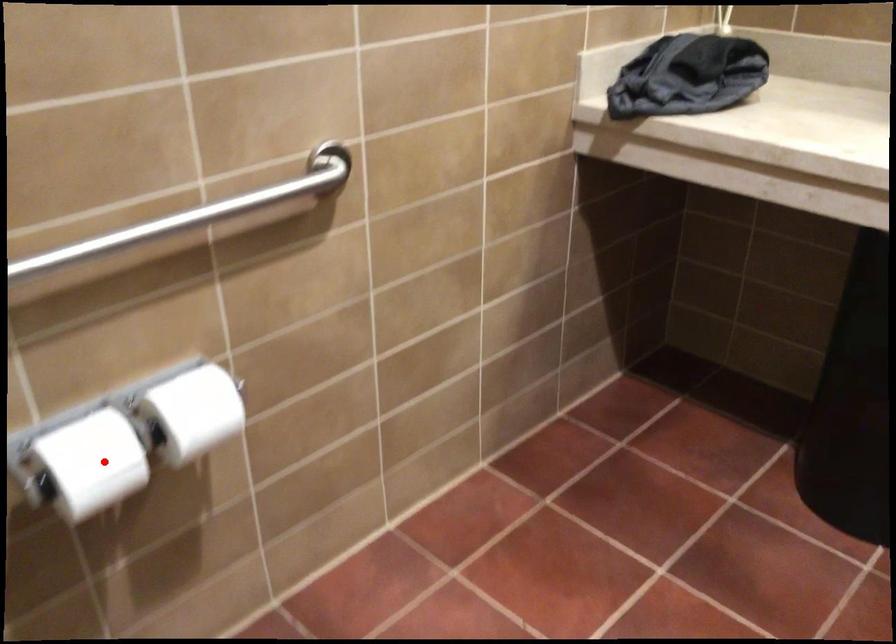
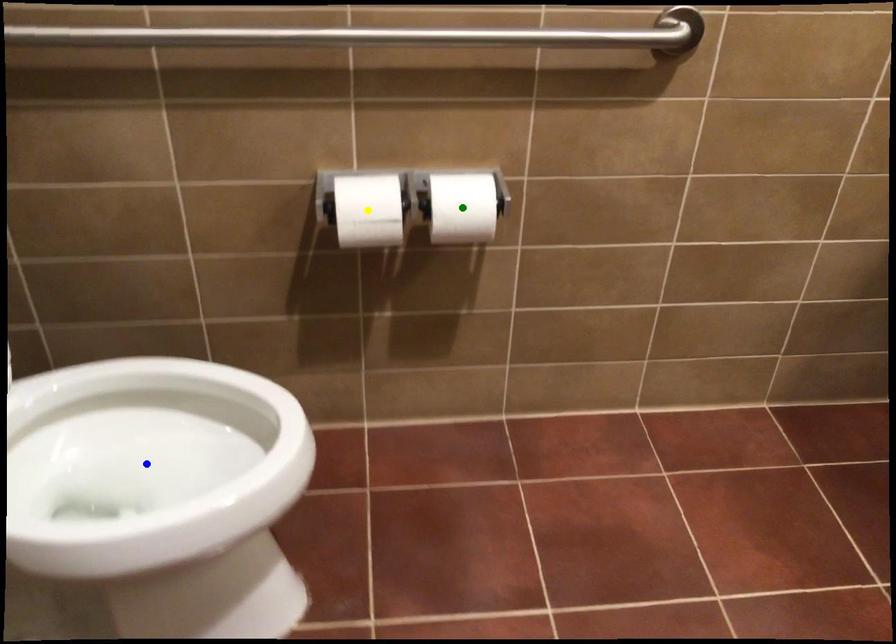
Question: I am providing you with two images of the same scene from different viewpoints. A red point is marked on the first image. You are given multiple points on the second image. Which point in image 2 represents the same 3d spot as the red point in image 1?

Choices:
 (A) blue point
 (B) green point
 (C) yellow point

Answer: (C)